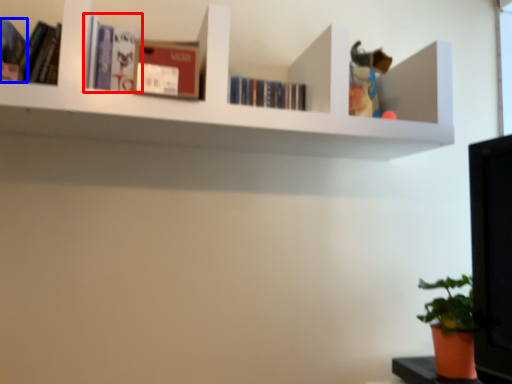
Question: Which of the following is the closest to the observer, book (highlighted by a red box) or book (highlighted by a blue box)?

Choices:
 (A) book
 (B) book

Answer: (B)